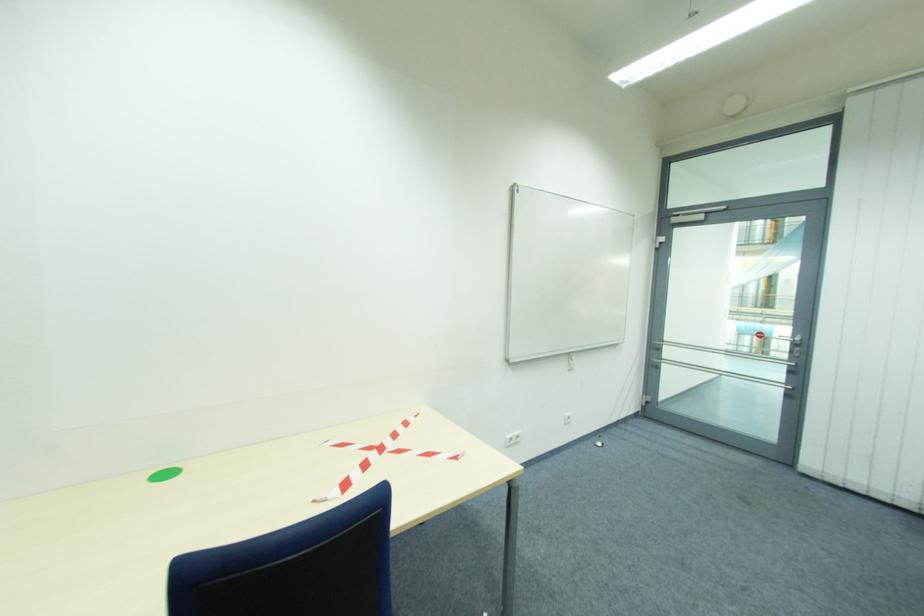
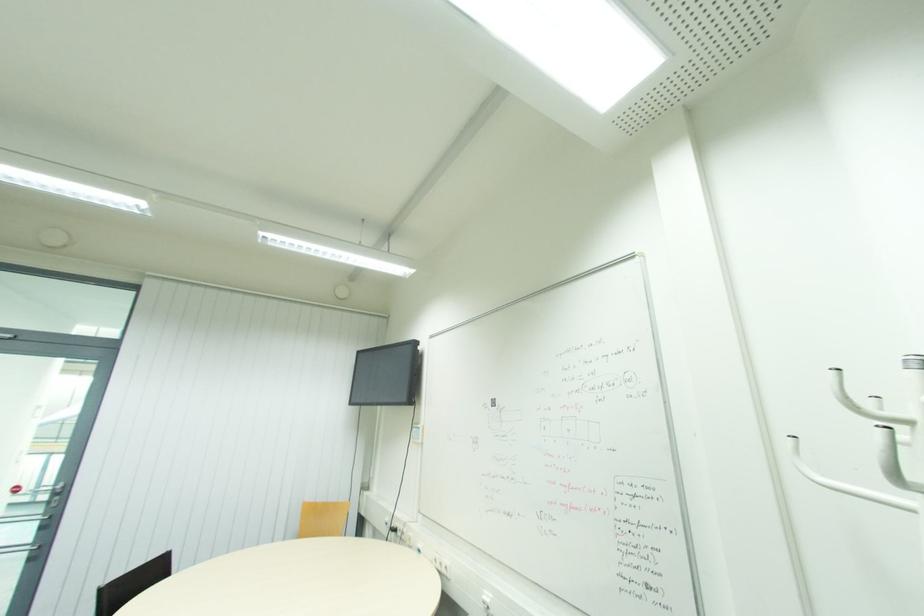
Consider the image. Based on the continuous images, in which direction is the camera rotating?

The camera's rotation is toward right-up.